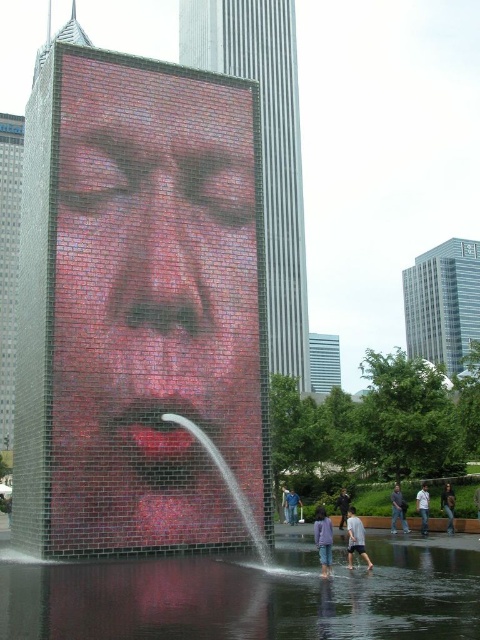
Which is behind, point (297, 520) or point (282, 490)?

The point (282, 490) is behind.

Identify the location of blue denim jeans at lower center. [291, 506].

Is clear water at center above gray cotton shirt at lower center?

Correct, clear water at center is located above gray cotton shirt at lower center.

Is point (376, 605) in front of point (361, 554)?

Yes, it is in front of point (361, 554).

Describe the element at coordinates (243, 596) in the screenshot. This screenshot has width=480, height=640. I see `clear water at center` at that location.

Find the location of a particular element. clear water at center is located at coordinates (243, 596).

Who is taller, dark gray fabric pants at lower center or blue jeans at lower center?

blue jeans at lower center

Is point (400, 513) closer to viewer compared to point (286, 493)?

Yes, it is in front of point (286, 493).

Describe the element at coordinates (397, 509) in the screenshot. I see `dark gray fabric pants at lower center` at that location.

The width and height of the screenshot is (480, 640). In order to click on dark gray fabric pants at lower center in this screenshot , I will do `click(397, 509)`.